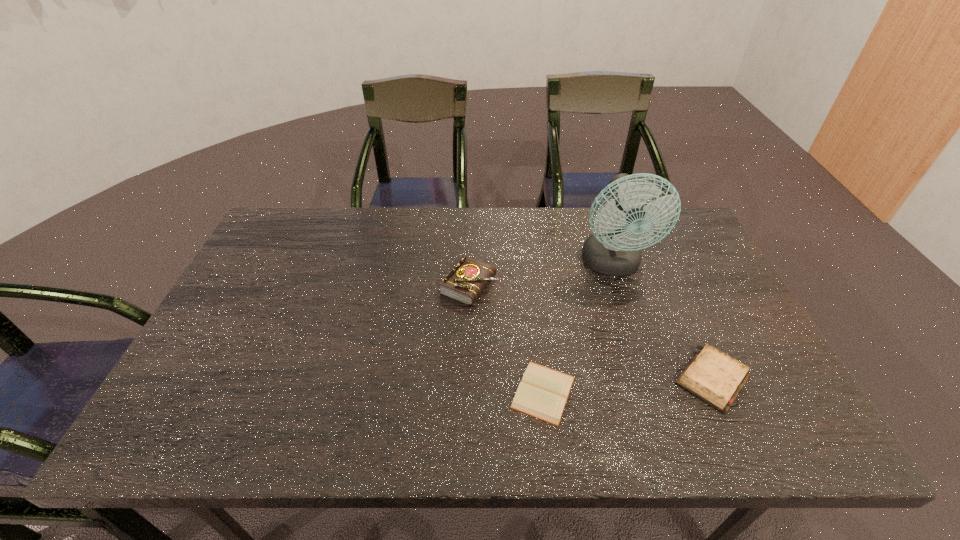
Identify which object is the second closest to the fan. Please provide its 2D coordinates. Your answer should be formatted as a tuple, i.e. [(x, y)], where the tuple contains the x and y coordinates of a point satisfying the conditions above.

[(465, 282)]

Locate which object is the third closest to the fan. Please provide its 2D coordinates. Your answer should be formatted as a tuple, i.e. [(x, y)], where the tuple contains the x and y coordinates of a point satisfying the conditions above.

[(543, 392)]

At what (x,y) coordinates should I click in order to perform the action: click on diary that stands as the closest to the leftmost object. Please return your answer as a coordinate pair (x, y). Image resolution: width=960 pixels, height=540 pixels. Looking at the image, I should click on (543, 392).

Locate which diary is the closest to the third tallest object. Please provide its 2D coordinates. Your answer should be formatted as a tuple, i.e. [(x, y)], where the tuple contains the x and y coordinates of a point satisfying the conditions above.

[(543, 392)]

The width and height of the screenshot is (960, 540). Identify the location of free region that satisfies the following two spatial constraints: 1. on the front side of the farthest diary; 2. on the right side of the second tallest diary. 468,379.

Locate an element on the screen. This screenshot has height=540, width=960. free location that satisfies the following two spatial constraints: 1. in front of the tallest object where the airflow is directed; 2. on the right side of the third tallest object is located at coordinates (650, 379).

Identify the location of vacant space that satisfies the following two spatial constraints: 1. in front of the second tallest diary where the airflow is directed; 2. on the right side of the tallest object. (650, 379).